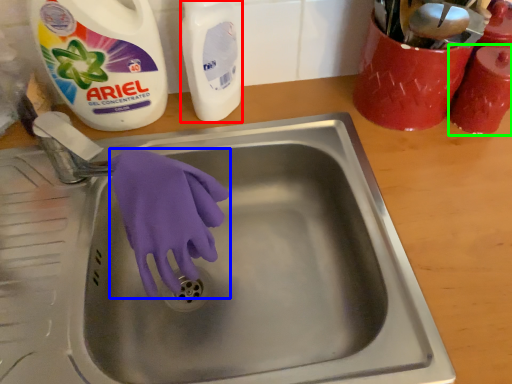
Question: Which object is positioned closest to cleaning product (highlighted by a red box)? Select from glove (highlighted by a blue box) and cleaning product (highlighted by a green box).

Choices:
 (A) glove
 (B) cleaning product

Answer: (A)